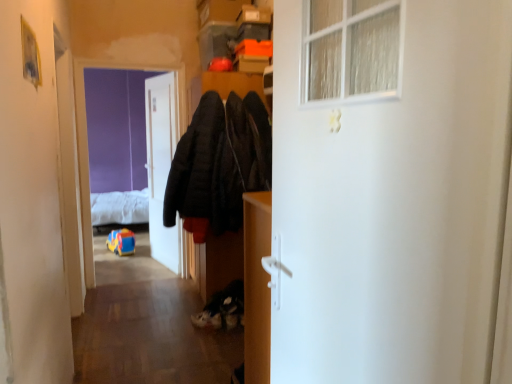
Question: Based on their positions, is purple matte screen door at upper left located to the left or right of dark matte coat at center?

Choices:
 (A) right
 (B) left

Answer: (B)

Question: In terms of size, does purple matte screen door at upper left appear bigger or smaller than dark matte coat at center?

Choices:
 (A) small
 (B) big

Answer: (A)

Question: Estimate the real-world distances between objects in this image. Which object is closer to the matte wood cabinet at center?

Choices:
 (A) white fluffy bed at upper left
 (B) white matte door at center, the first door from the front
 (C) wooden floor at lower center
 (D) purple matte screen door at upper left
 (E) white suede shoe at lower center

Answer: (B)

Question: Estimate the real-world distances between objects in this image. Which object is closer to the purple matte screen door at upper left?

Choices:
 (A) dark matte coat at center
 (B) white suede shoe at lower center
 (C) wooden floor at lower center
 (D) white matte door at center, which is the first door in right-to-left order
 (E) white fluffy bed at upper left

Answer: (E)